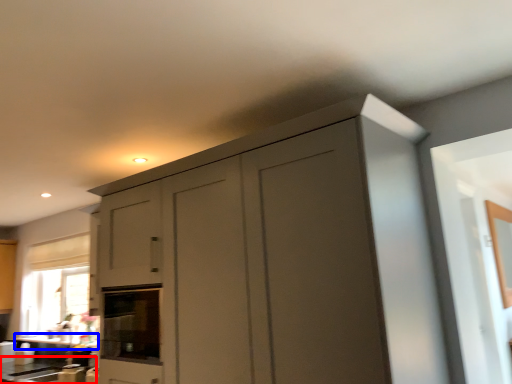
Question: Which point is further to the camera, counter top (highlighted by a red box) or counter top (highlighted by a blue box)?

Choices:
 (A) counter top
 (B) counter top

Answer: (B)